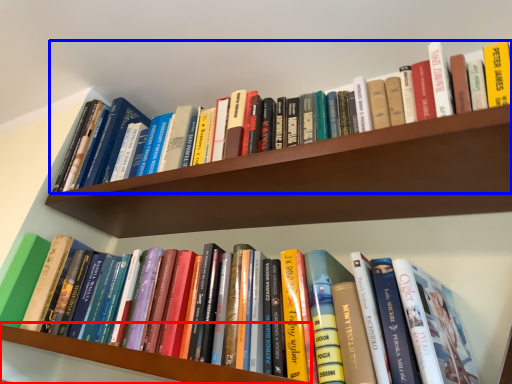
Question: Among these objects, which one is nearest to the camera, shelf (highlighted by a red box) or book (highlighted by a blue box)?

Choices:
 (A) shelf
 (B) book

Answer: (A)